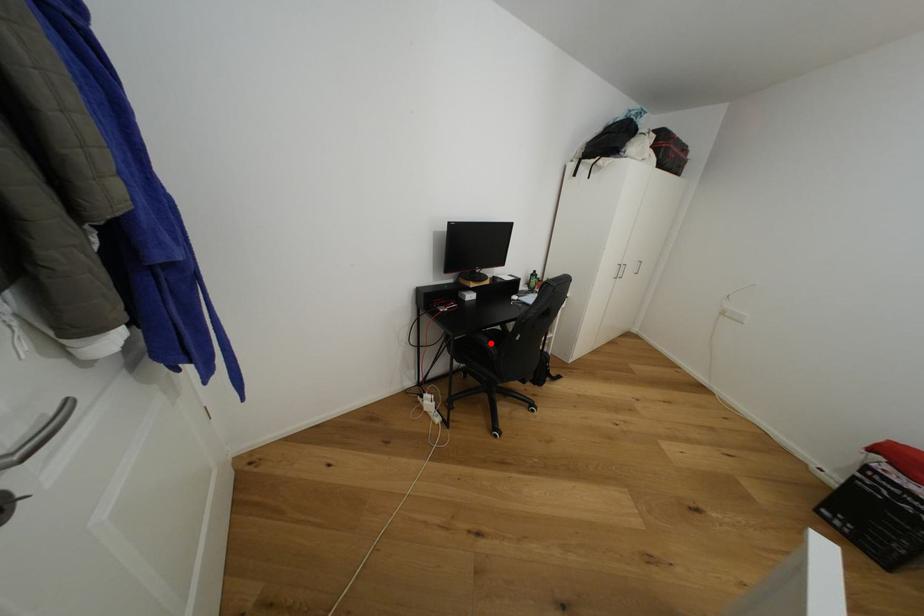
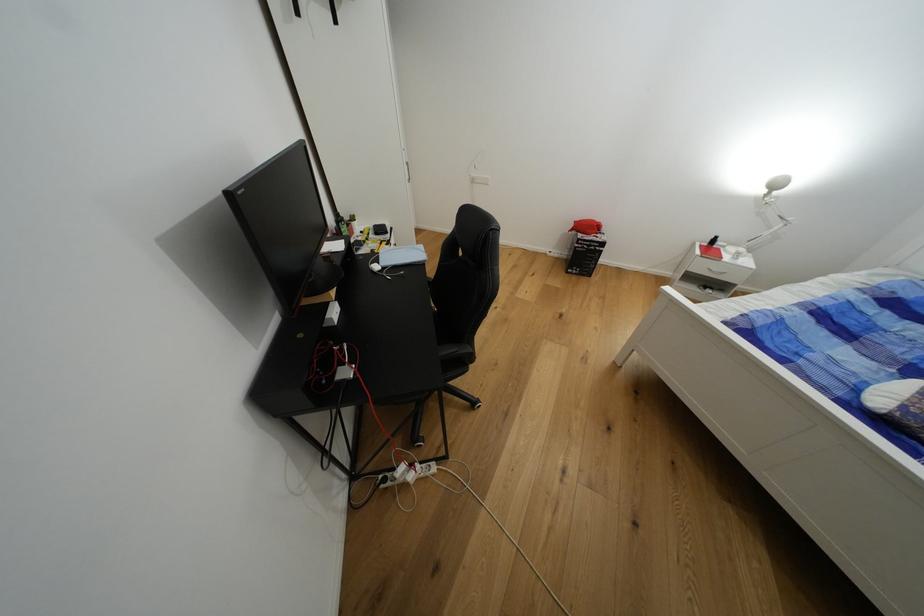
Where in the second image is the point corresponding to the highlighted location from the first image?

(460, 351)